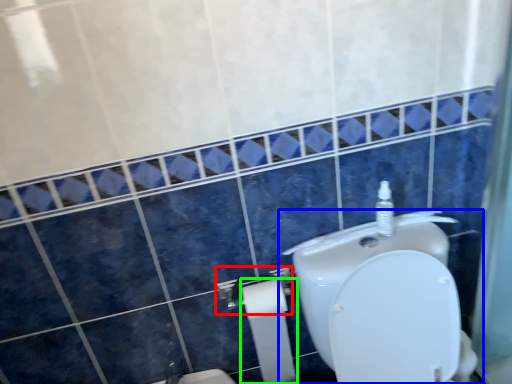
Question: Based on their relative distances, which object is farther from shower (highlighted by a red box)? Choose from toilet (highlighted by a blue box) and toilet paper (highlighted by a green box).

Choices:
 (A) toilet
 (B) toilet paper

Answer: (A)